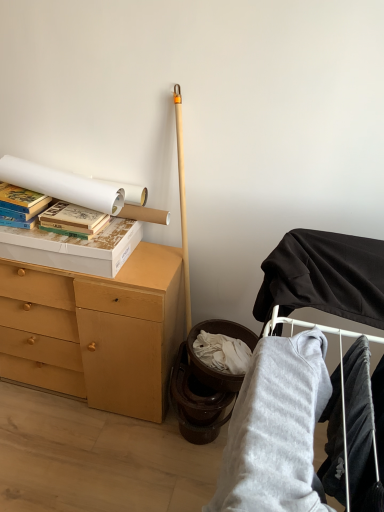
You are a GUI agent. You are given a task and a screenshot of the screen. Output one action in this format:
    pyautogui.click(x=<x>, y=<y>)
    Task: Click on the vacant space in front of matte cardboard book at upper left, which is the first paperback book from right to left
    
    Given the screenshot: What is the action you would take?
    (x=76, y=242)